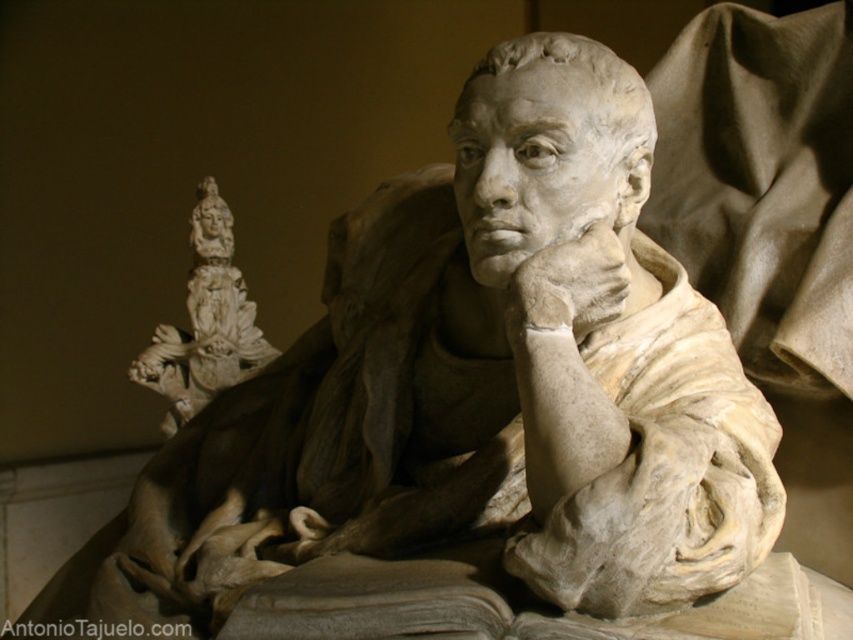
You are an art conservator examining the sculpture. You notice the white marble hand at center and the white marble statue at upper left. Which object is positioned farther away from the viewer?

Result: The white marble hand at center is behind the white marble statue at upper left, so it is farther away from the viewer.

You are an art conservator examining the sculpture. You need to place a protective barrier around the white marble statue at upper left. Where exactly should you position it based on its coordinates?

The white marble statue at upper left is located at coordinates point (204, 323), so place the barrier around that point.